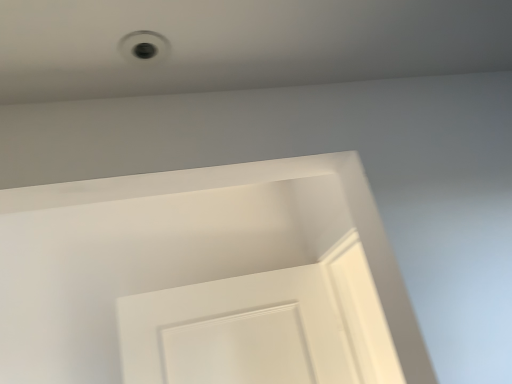
Question: Considering the relative sizes of white plastic hole at upper center and white matte door at center in the image provided, is white plastic hole at upper center shorter than white matte door at center?

Choices:
 (A) no
 (B) yes

Answer: (B)

Question: Is white plastic hole at upper center far from white matte door at center?

Choices:
 (A) no
 (B) yes

Answer: (B)

Question: From the image's perspective, is white plastic hole at upper center on top of white matte door at center?

Choices:
 (A) yes
 (B) no

Answer: (A)

Question: Is white matte door at center located within white plastic hole at upper center?

Choices:
 (A) no
 (B) yes

Answer: (A)

Question: Considering the relative sizes of white plastic hole at upper center and white matte door at center in the image provided, is white plastic hole at upper center smaller than white matte door at center?

Choices:
 (A) yes
 (B) no

Answer: (A)

Question: Does white plastic hole at upper center appear on the right side of white matte door at center?

Choices:
 (A) yes
 (B) no

Answer: (A)

Question: Is white matte door at center oriented away from white plastic hole at upper center?

Choices:
 (A) yes
 (B) no

Answer: (B)

Question: Is white matte door at center in contact with white plastic hole at upper center?

Choices:
 (A) no
 (B) yes

Answer: (A)

Question: Can you confirm if white matte door at center is positioned to the left of white plastic hole at upper center?

Choices:
 (A) no
 (B) yes

Answer: (B)

Question: From the image's perspective, is white matte door at center on top of white plastic hole at upper center?

Choices:
 (A) yes
 (B) no

Answer: (B)

Question: From a real-world perspective, does white matte door at center stand above white plastic hole at upper center?

Choices:
 (A) yes
 (B) no

Answer: (B)

Question: Can you confirm if white matte door at center is positioned to the right of white plastic hole at upper center?

Choices:
 (A) yes
 (B) no

Answer: (B)

Question: Is white matte door at center wider or thinner than white plastic hole at upper center?

Choices:
 (A) wide
 (B) thin

Answer: (A)